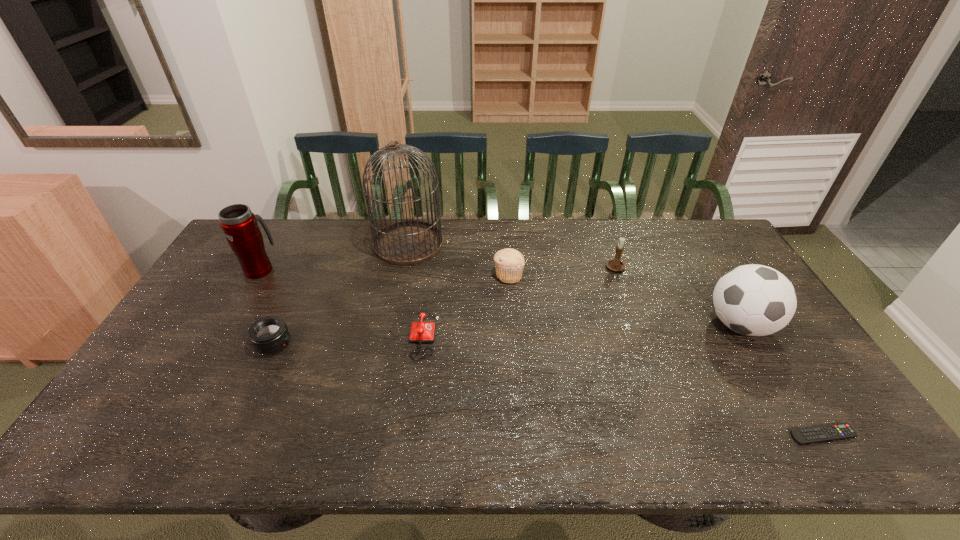
Where is `vacant space located 0.150m on the back of the nearest object`? This screenshot has width=960, height=540. vacant space located 0.150m on the back of the nearest object is located at coordinates (783, 373).

Find the location of a particular element. object that is positioned at the far edge is located at coordinates pyautogui.click(x=411, y=242).

Find the location of a particular element. This screenshot has width=960, height=540. object located in the near edge section of the desktop is located at coordinates (808, 435).

Find the location of `object located at the left edge`. object located at the left edge is located at coordinates (239, 224).

Identify the location of soccer ball at the right edge. (755, 300).

I want to click on remote control that is at the right edge, so click(x=808, y=435).

Identify the location of object present at the near right corner. (808, 435).

In the image, there is a desktop. At what (x,y) coordinates should I click in order to perform the action: click on blank space at the far edge. Please return your answer as a coordinate pair (x, y). The image size is (960, 540). Looking at the image, I should click on (632, 227).

Identify the location of vacant point at the near edge. (414, 429).

In order to click on vacant space at the left edge of the desktop in this screenshot , I will do `click(128, 403)`.